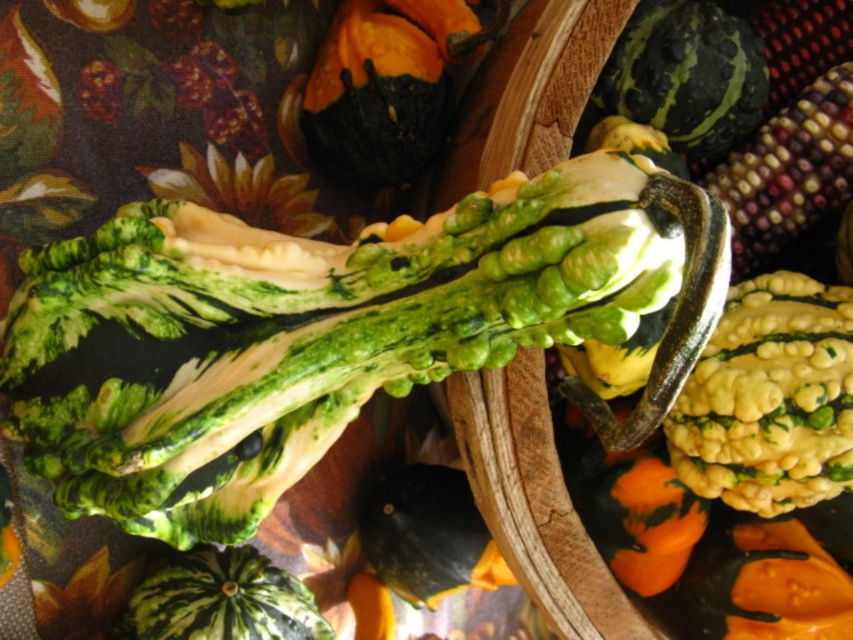
Does point (386, 17) come farther from viewer compared to point (817, 168)?

That is False.

Is point (343, 17) more distant than point (844, 180)?

Yes, point (343, 17) is farther from viewer.

I want to click on dark green textured gourd at upper center, so click(x=387, y=84).